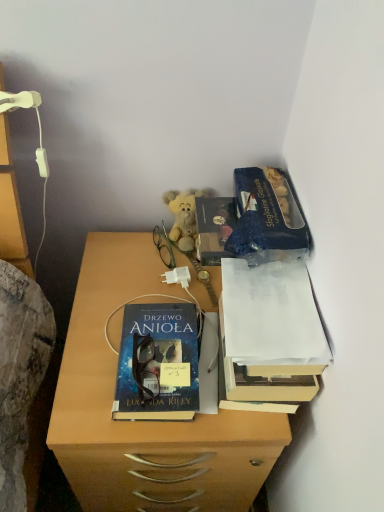
Where is `free spot above matte wooden desk at center (from a real-world perspective)`? The image size is (384, 512). free spot above matte wooden desk at center (from a real-world perspective) is located at coordinates (150, 298).